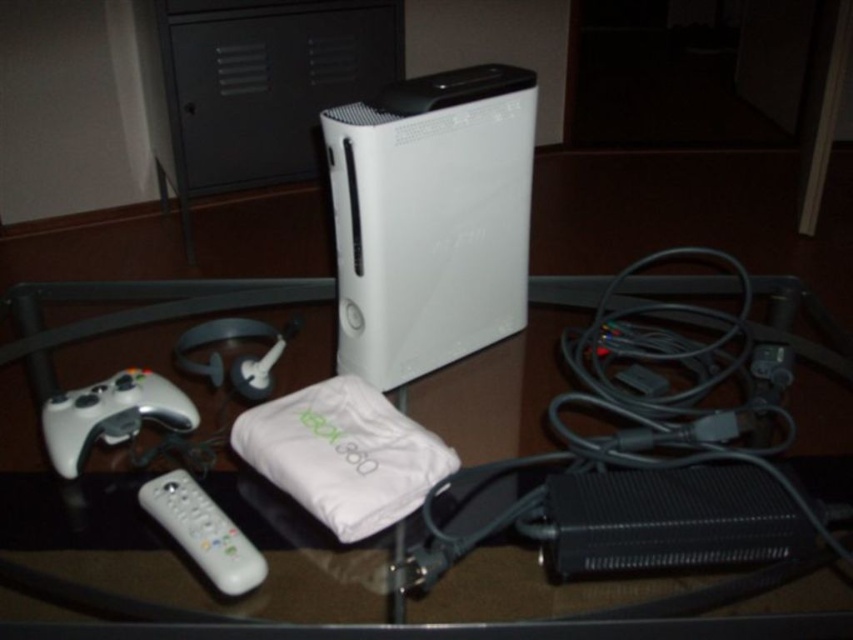
Is white matte wii at center to the right of white plastic remote at lower left from the viewer's perspective?

Yes, white matte wii at center is to the right of white plastic remote at lower left.

Which is behind, point (421, 156) or point (219, 531)?

The point (421, 156) is more distant.

Find the location of a particular element. Image resolution: width=853 pixels, height=640 pixels. white matte wii at center is located at coordinates (430, 218).

Between transparent glass table at center and white plastic remote at lower left, which one has more height?

transparent glass table at center

Looking at this image, who is more distant from viewer, (256,285) or (178,516)?

The point (256,285) is more distant.

At what (x,y) coordinates should I click in order to perform the action: click on transparent glass table at center. Please return your answer as a coordinate pair (x, y). Image resolution: width=853 pixels, height=640 pixels. Looking at the image, I should click on (144, 308).

Can you confirm if transparent glass table at center is bigger than white matte game controller at lower left?

Correct, transparent glass table at center is larger in size than white matte game controller at lower left.

Does transparent glass table at center have a smaller size compared to white matte game controller at lower left?

No.

Where is `transparent glass table at center`? This screenshot has height=640, width=853. transparent glass table at center is located at coordinates (144, 308).

I want to click on transparent glass table at center, so click(144, 308).